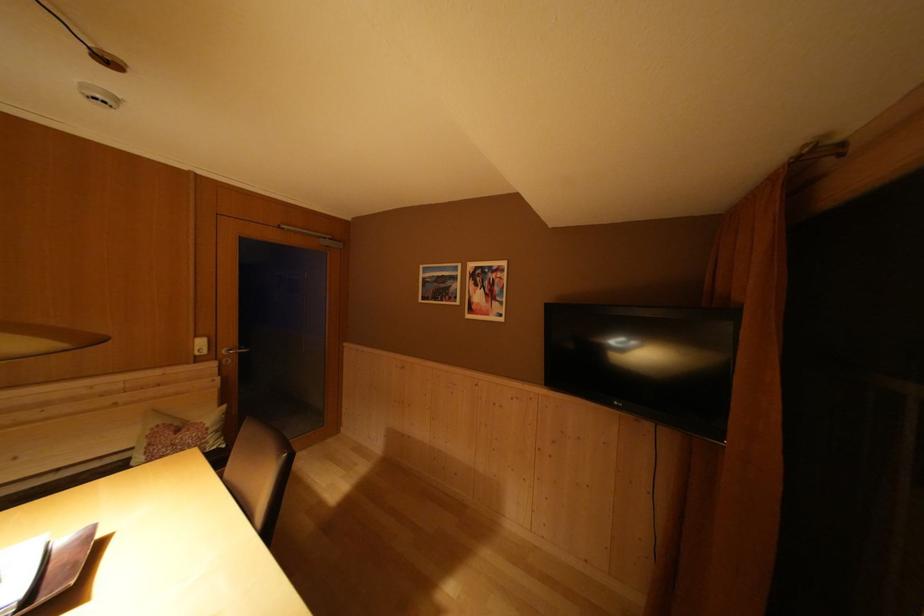
Image resolution: width=924 pixels, height=616 pixels. What do you see at coordinates (249, 459) in the screenshot?
I see `a chair sitting surface` at bounding box center [249, 459].